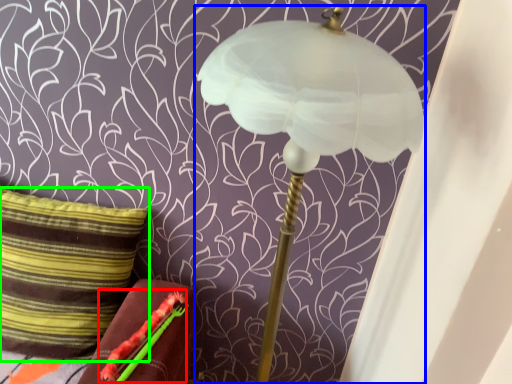
Question: Which object is the closest to the flower (highlighted by a red box)? Choose among these: lamp (highlighted by a blue box) or pillow (highlighted by a green box).

Choices:
 (A) lamp
 (B) pillow

Answer: (B)